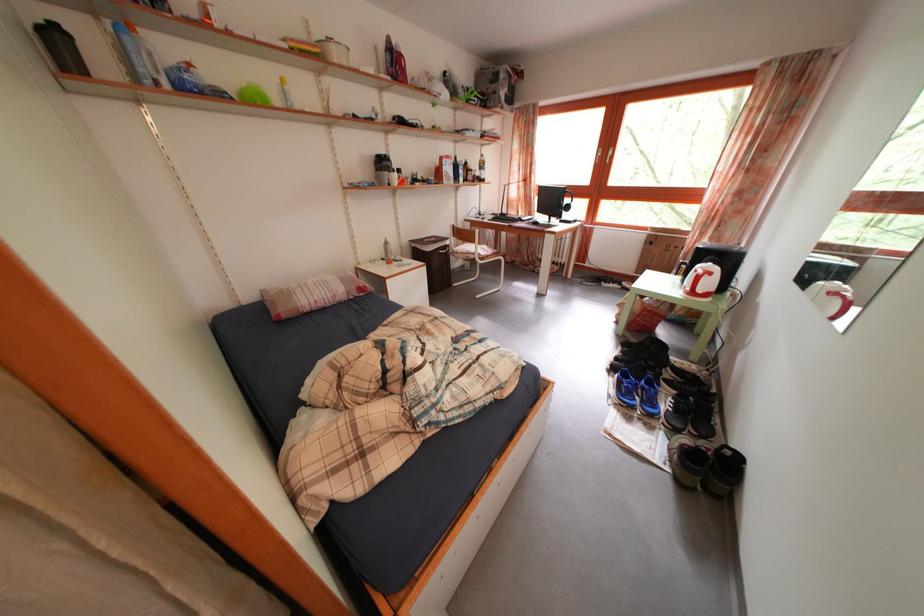
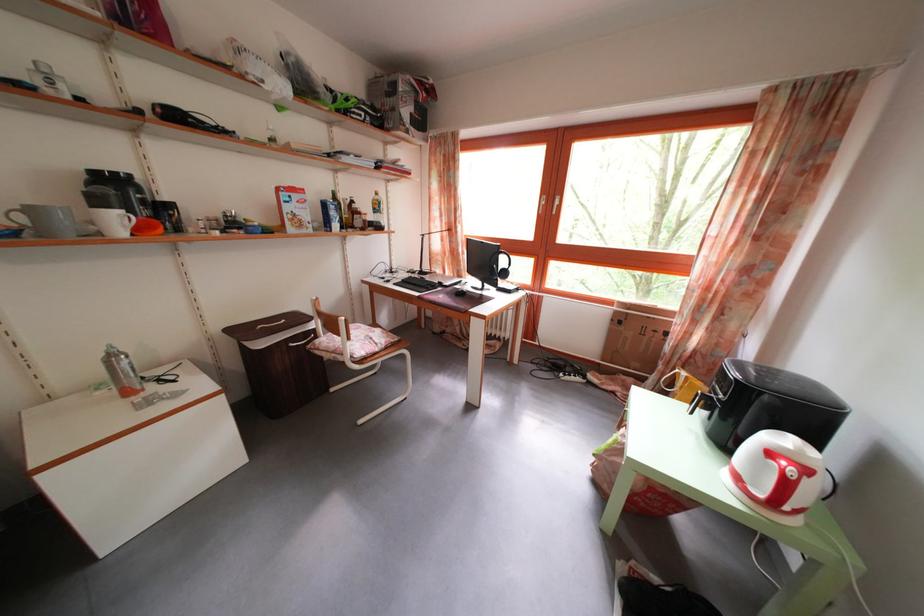
Locate, in the second image, the point that corresponds to point (657, 243) in the first image.

(623, 320)